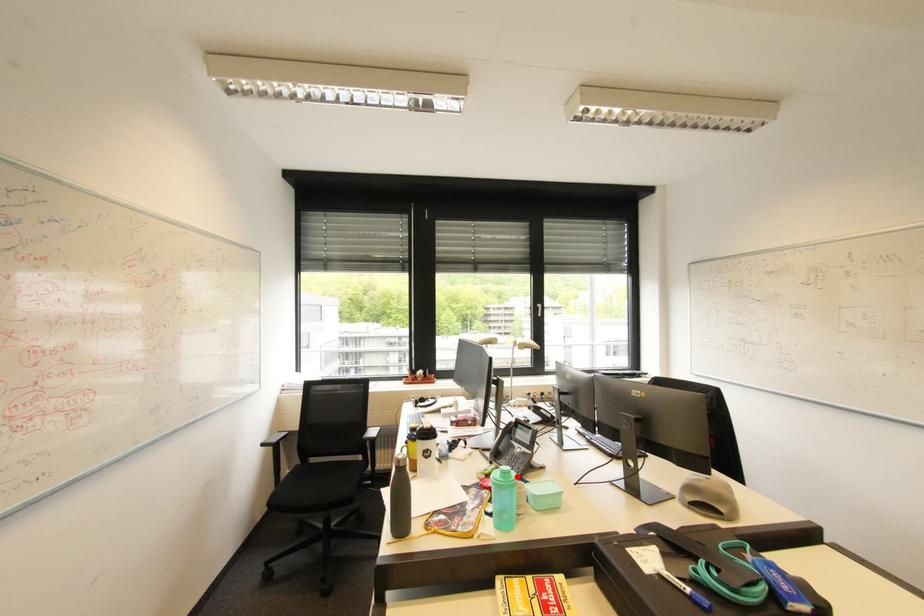
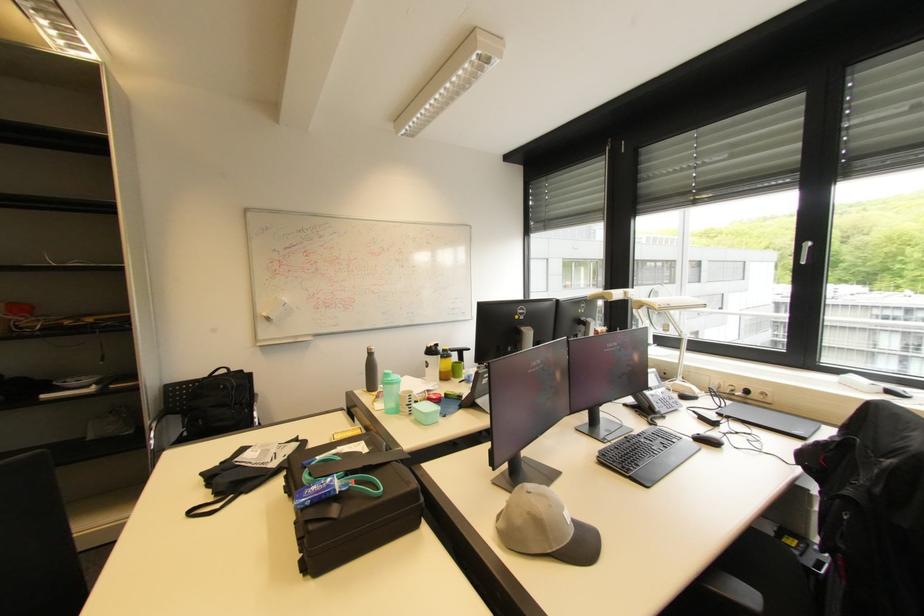
Find the pixel in the second image that matches the highlighted location in the first image.

(394, 379)